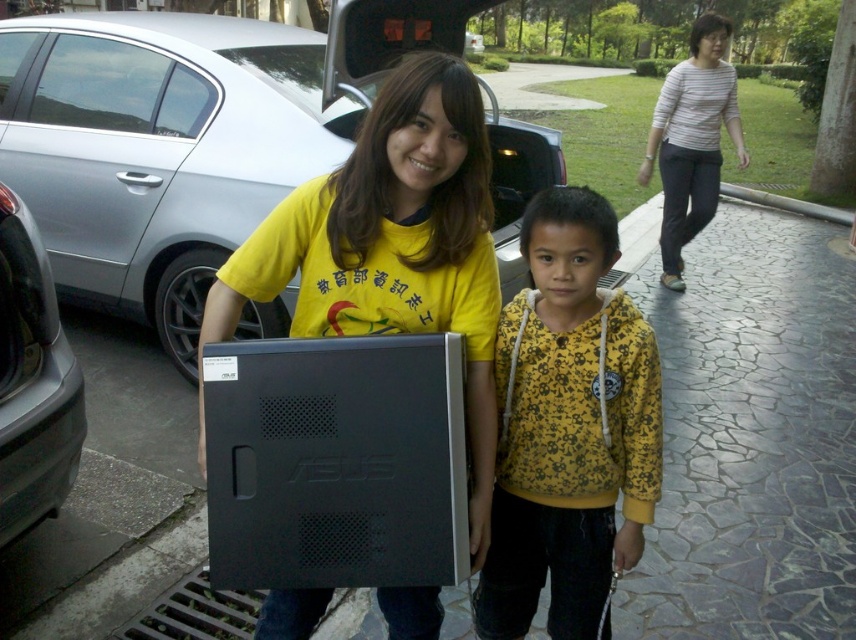
Question: Is yellow printed hoodie at center below striped cotton shirt at upper right?

Choices:
 (A) no
 (B) yes

Answer: (B)

Question: Is matte black monitor at center below glossy metallic car at lower left?

Choices:
 (A) yes
 (B) no

Answer: (A)

Question: Which of these objects is positioned farthest from the glossy metallic car at lower left?

Choices:
 (A) yellow printed hoodie at center
 (B) striped cotton shirt at upper right
 (C) matte black monitor at center
 (D) black plastic computer at center

Answer: (B)

Question: Which object is positioned farthest from the satin silver sedan at center?

Choices:
 (A) black plastic computer at center
 (B) matte black monitor at center
 (C) striped cotton shirt at upper right
 (D) glossy metallic car at lower left

Answer: (C)

Question: Is black plastic computer at center smaller than matte black monitor at center?

Choices:
 (A) no
 (B) yes

Answer: (B)

Question: Among these points, which one is nearest to the camera?

Choices:
 (A) (488, 452)
 (B) (700, 33)
 (C) (286, 378)

Answer: (C)